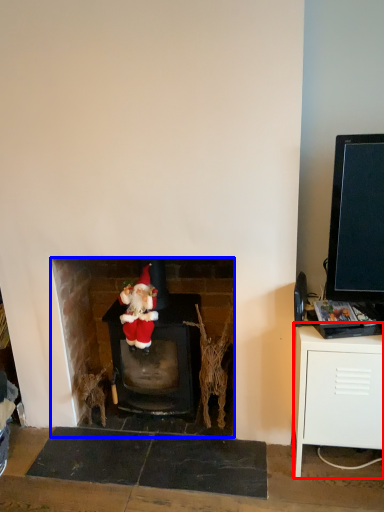
Question: Which object is further to the camera taking this photo, table (highlighted by a red box) or fireplace (highlighted by a blue box)?

Choices:
 (A) table
 (B) fireplace

Answer: (B)